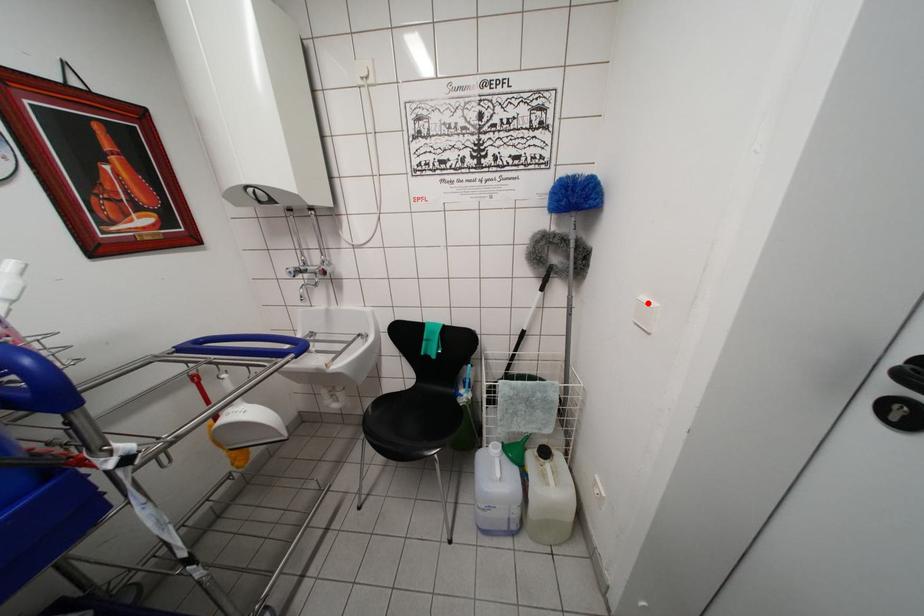
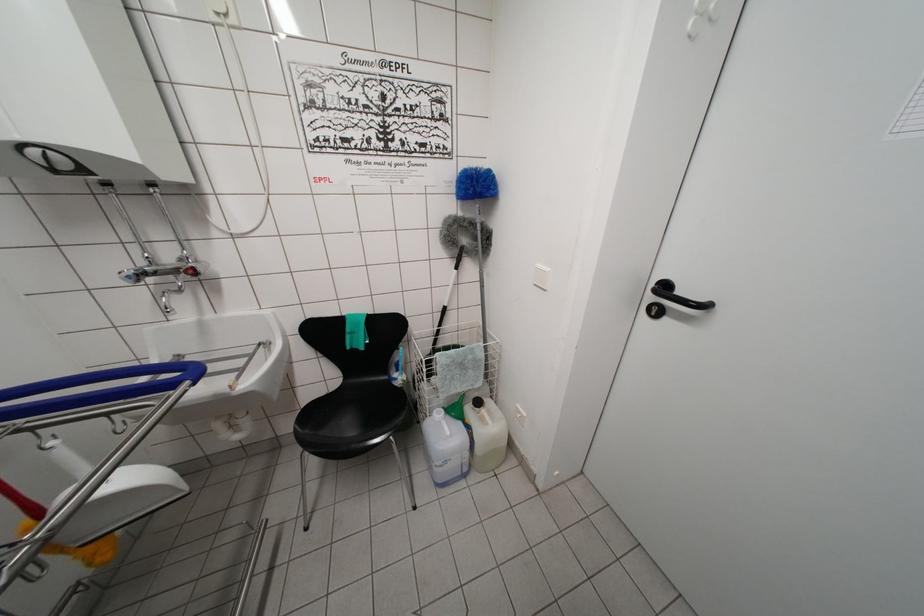
Where in the second image is the point corresponding to the highlighted location from the first image?

(542, 270)